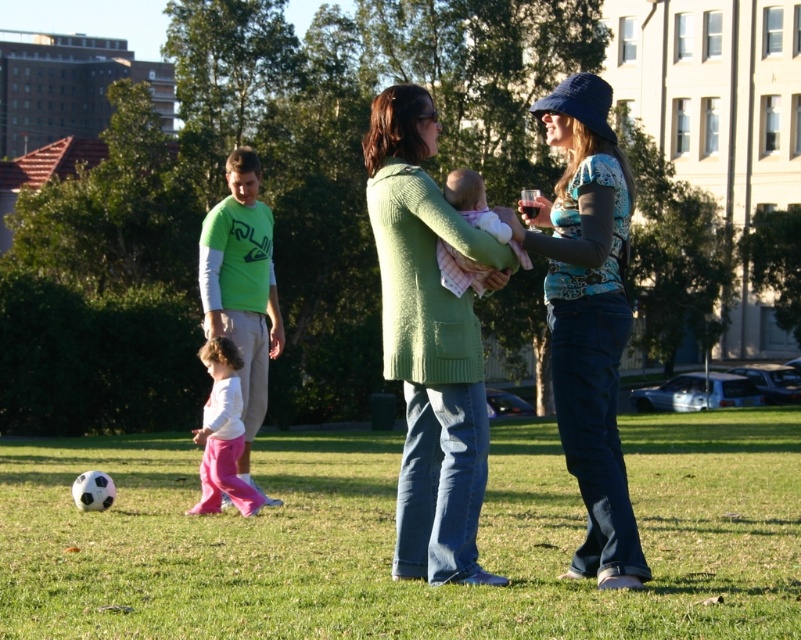
Question: Is green long-sleeved shirt at center to the right of soft pink fabric baby at center from the viewer's perspective?

Choices:
 (A) yes
 (B) no

Answer: (B)

Question: Based on their relative distances, which object is nearer to the blue denim jeans at center?

Choices:
 (A) white soccer ball at lower left
 (B) pink fleece pants at lower left

Answer: (B)

Question: Can you confirm if white soccer ball at lower left is positioned below matte green sweater at center?

Choices:
 (A) yes
 (B) no

Answer: (A)

Question: Among these points, which one is farthest from the camera?

Choices:
 (A) (477, 189)
 (B) (552, 362)

Answer: (B)

Question: Which of the following is the closest to the observer?

Choices:
 (A) soft pink fabric baby at center
 (B) matte green sweater at center

Answer: (A)

Question: Is white soccer ball at lower left further to the viewer compared to green long-sleeved shirt at center?

Choices:
 (A) yes
 (B) no

Answer: (B)